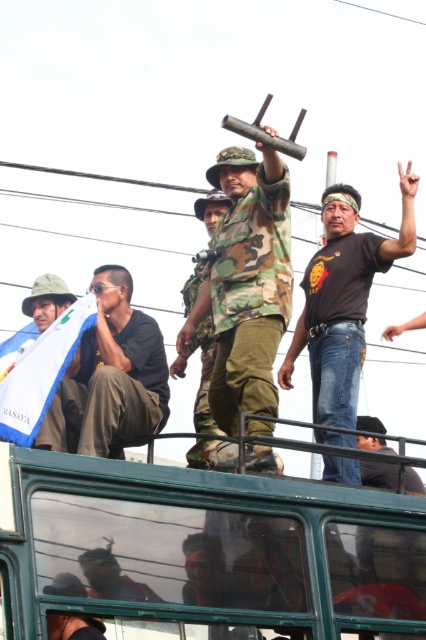
You are a pedestrian standing on the sidewalk and see the green matte bus at upper center and the black leather jacket at lower right. Which object is closer to you?

The green matte bus at upper center is closer to you because it is in front of the black leather jacket at lower right.